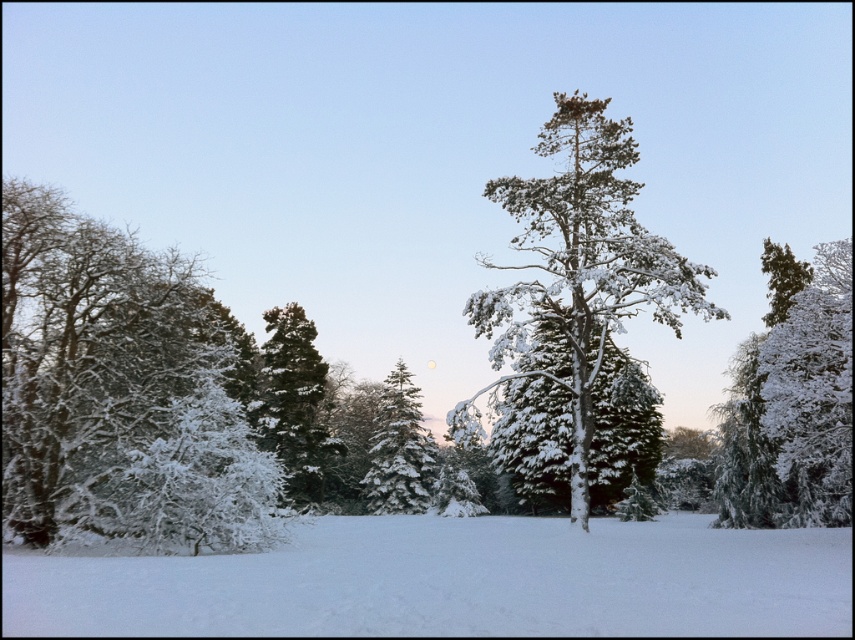
Question: Is white fluffy snow at center further to the viewer compared to snow-covered evergreen at center?

Choices:
 (A) yes
 (B) no

Answer: (B)

Question: Which object is the farthest from the white snow-covered tree at right?

Choices:
 (A) green matte tree at upper right
 (B) green matte tree at center
 (C) white fluffy snow at center
 (D) snow-covered pine at center

Answer: (B)

Question: Which object appears closest to the camera in this image?

Choices:
 (A) snow-covered pine tree at center
 (B) snow-covered evergreen at center
 (C) white frosty tree at left

Answer: (C)

Question: Is white frosty tree at left above snow-covered evergreen at center?

Choices:
 (A) yes
 (B) no

Answer: (A)

Question: Does white frosty tree at left appear on the right side of snow-covered evergreen at center?

Choices:
 (A) no
 (B) yes

Answer: (A)

Question: Which object appears closest to the camera in this image?

Choices:
 (A) green matte tree at upper right
 (B) white fluffy snow at center
 (C) snow-covered evergreen at center
 (D) snow-covered pine at center

Answer: (B)